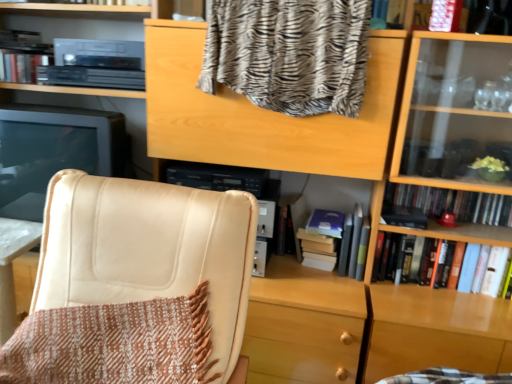
Question: Is gray matte book at center, the 3th book in the right-to-left sequence, positioned beyond the bounds of brown woven blanket at lower left, the 2th blanket in the top-to-bottom sequence?

Choices:
 (A) no
 (B) yes

Answer: (B)

Question: Considering the relative positions of gray matte book at center, arranged as the second book when viewed from the left, and brown woven blanket at lower left, the 2th blanket in the top-to-bottom sequence, in the image provided, is gray matte book at center, arranged as the second book when viewed from the left, behind brown woven blanket at lower left, the 2th blanket in the top-to-bottom sequence,?

Choices:
 (A) no
 (B) yes

Answer: (B)

Question: Does gray matte book at center, the third book when ordered from top to bottom, have a greater height compared to brown woven blanket at lower left, the 2th blanket in the top-to-bottom sequence?

Choices:
 (A) yes
 (B) no

Answer: (B)

Question: Is gray matte book at center, the 3th book in the right-to-left sequence, smaller than brown woven blanket at lower left, the 2th blanket in the top-to-bottom sequence?

Choices:
 (A) no
 (B) yes

Answer: (B)

Question: Are gray matte book at center, which is the second book in bottom-to-top order, and brown woven blanket at lower left, the 2th blanket in the top-to-bottom sequence, beside each other?

Choices:
 (A) yes
 (B) no

Answer: (B)

Question: Looking at the image, does hardcover book at right, which is the first book from bottom to top, seem bigger or smaller compared to zebra-patterned fabric at upper center, which appears as the second blanket when ordered from the bottom?

Choices:
 (A) big
 (B) small

Answer: (B)

Question: Is hardcover book at right, which appears as the 4th book when viewed from the top, in front of or behind zebra-patterned fabric at upper center, which is the 1th blanket in top-to-bottom order, in the image?

Choices:
 (A) front
 (B) behind

Answer: (B)

Question: From the image's perspective, is hardcover book at right, acting as the second book starting from the right, located above or below zebra-patterned fabric at upper center, which appears as the second blanket when ordered from the bottom?

Choices:
 (A) above
 (B) below

Answer: (B)

Question: Is point (433, 246) closer or farther from the camera than point (283, 28)?

Choices:
 (A) closer
 (B) farther

Answer: (B)

Question: Is brown woven blanket at lower left, the 2th blanket in the top-to-bottom sequence, spatially inside satin black monitor at left, or outside of it?

Choices:
 (A) inside
 (B) outside

Answer: (B)

Question: Is brown woven blanket at lower left, the 2th blanket in the top-to-bottom sequence, wider or thinner than satin black monitor at left?

Choices:
 (A) wide
 (B) thin

Answer: (A)

Question: Considering the relative positions of brown woven blanket at lower left, the 2th blanket in the top-to-bottom sequence, and satin black monitor at left in the image provided, is brown woven blanket at lower left, the 2th blanket in the top-to-bottom sequence, to the left or to the right of satin black monitor at left?

Choices:
 (A) left
 (B) right

Answer: (B)

Question: Is point (53, 379) closer or farther from the camera than point (32, 152)?

Choices:
 (A) closer
 (B) farther

Answer: (A)

Question: Is beige leather chair at left inside the boundaries of brown woven blanket at lower left, which appears as the 1th blanket when ordered from the bottom, or outside?

Choices:
 (A) inside
 (B) outside

Answer: (A)

Question: Is beige leather chair at left wider or thinner than brown woven blanket at lower left, which appears as the 1th blanket when ordered from the bottom?

Choices:
 (A) thin
 (B) wide

Answer: (B)